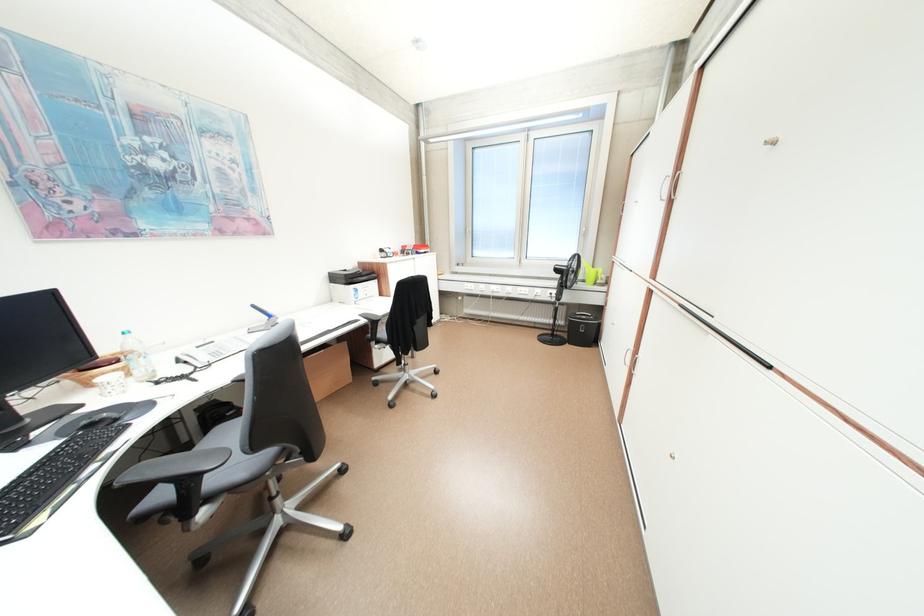
This screenshot has height=616, width=924. I want to click on grey chair armrest, so click(x=175, y=467).